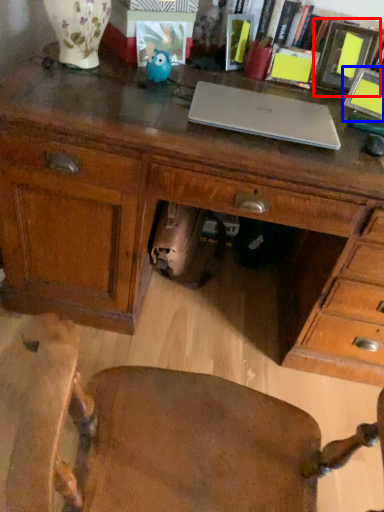
Question: Which of the following is the farthest to the observer, picture frame (highlighted by a red box) or picture frame (highlighted by a blue box)?

Choices:
 (A) picture frame
 (B) picture frame

Answer: (A)